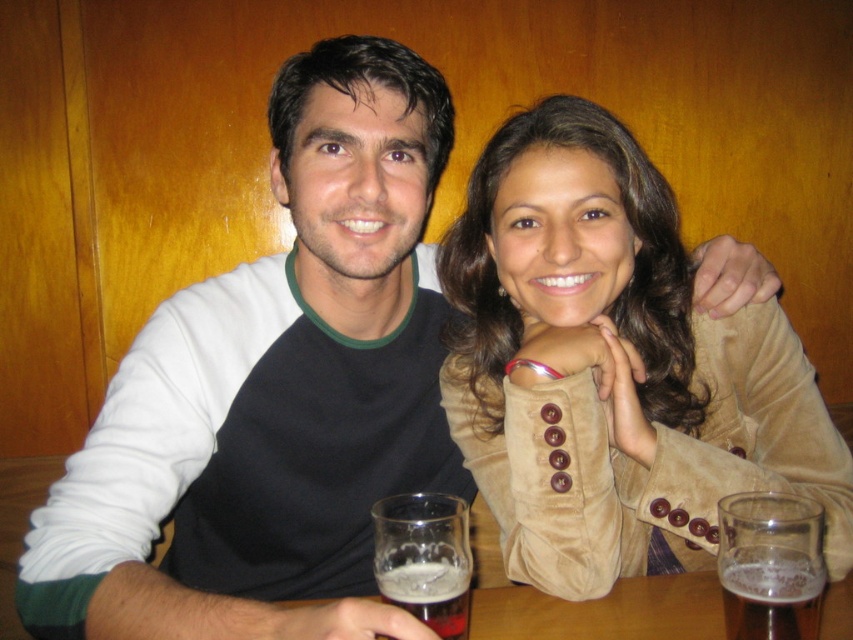
Describe the element at coordinates (770, 596) in the screenshot. This screenshot has height=640, width=853. I see `foamy amber liquid at lower right` at that location.

Can you confirm if foamy amber liquid at lower right is positioned above foamy amber liquid at lower center?

Yes, foamy amber liquid at lower right is above foamy amber liquid at lower center.

Find the location of a particular element. The height and width of the screenshot is (640, 853). foamy amber liquid at lower right is located at coordinates (770, 596).

Who is lower down, suede jacket at center or foamy amber liquid at lower right?

foamy amber liquid at lower right is below.

Is suede jacket at center smaller than foamy amber liquid at lower right?

No.

Which is behind, point (587, 545) or point (799, 618)?

Point (587, 545)

Where is `suede jacket at center`? suede jacket at center is located at coordinates (614, 368).

Based on the photo, is clear glass beer at lower center thinner than foamy amber liquid at lower center?

No.

Can you confirm if clear glass beer at lower center is positioned below foamy amber liquid at lower center?

No, clear glass beer at lower center is not below foamy amber liquid at lower center.

You are a GUI agent. You are given a task and a screenshot of the screen. Output one action in this format:
    pyautogui.click(x=<x>, y=<y>)
    Task: Click on the clear glass beer at lower center
    This screenshot has height=640, width=853.
    Given the screenshot: What is the action you would take?
    pyautogui.click(x=770, y=564)